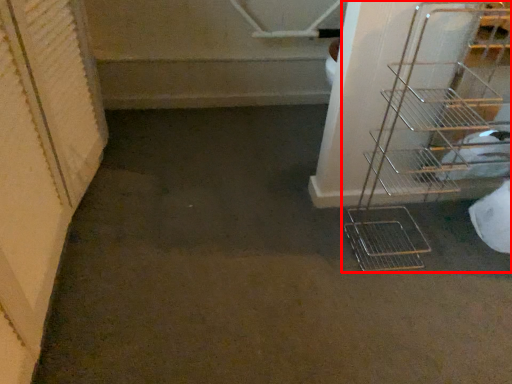
Question: From the image's perspective, what is the correct spatial relationship of shelf (annotated by the red box) in relation to stairs?

Choices:
 (A) below
 (B) above

Answer: (A)